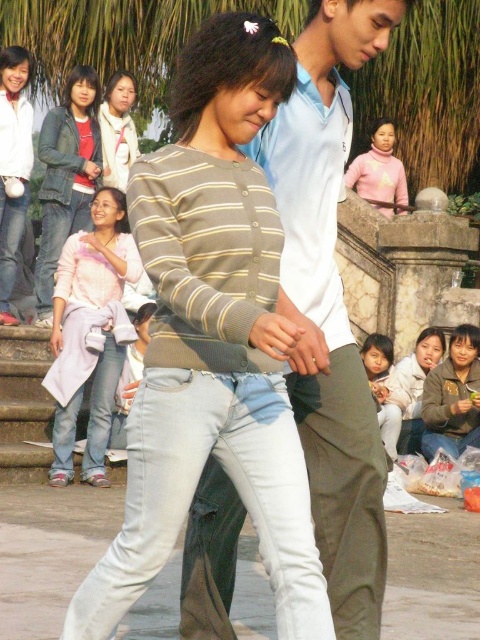
You are standing at the point labeled as point (69, 253) in the image. You want to throw a ball to a friend who is standing at your original position. If the maximum throwing distance you can reach is 30 meters, will you be able to successfully throw the ball to your friend?

The distance between point (69, 253) and the viewer is 28.98 meters, which is within your maximum throwing distance of 30 meters. Therefore, you can successfully throw the ball to your friend.

You are standing at the center of the scene and want to greet both people. Which direction should you walk to reach the gray fleece jacket at lower right first before the white matte shirt at upper left?

You should walk towards the lower right direction first to reach the gray fleece jacket at lower right before the white matte shirt at upper left because it is closer to you than the white matte shirt at upper left.